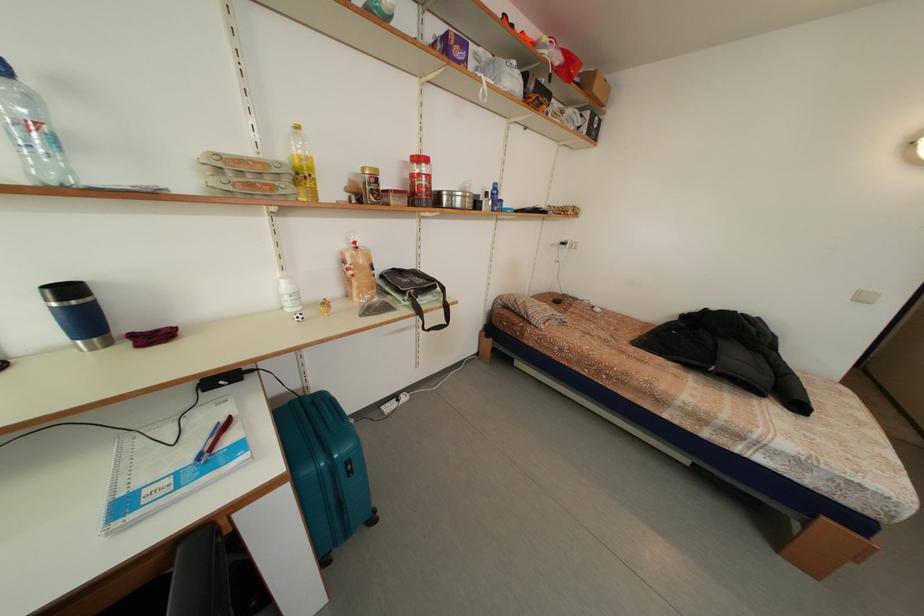
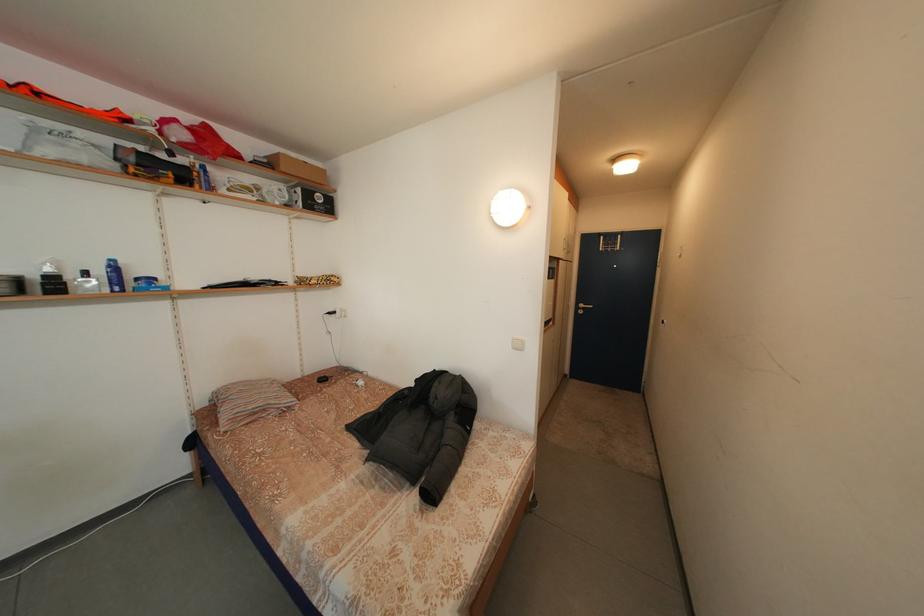
Locate, in the second image, the point that corresponds to point 594,119 in the first image.

(307, 196)